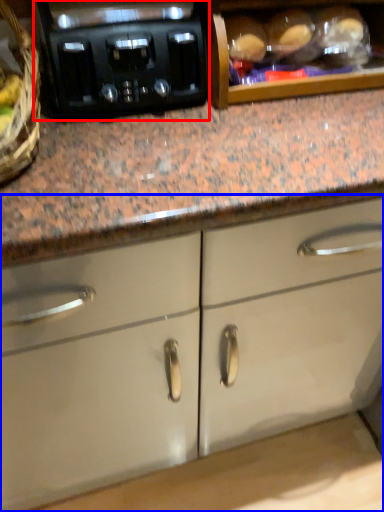
Question: Which object is closer to the camera taking this photo, home appliance (highlighted by a red box) or cabinetry (highlighted by a blue box)?

Choices:
 (A) home appliance
 (B) cabinetry

Answer: (A)